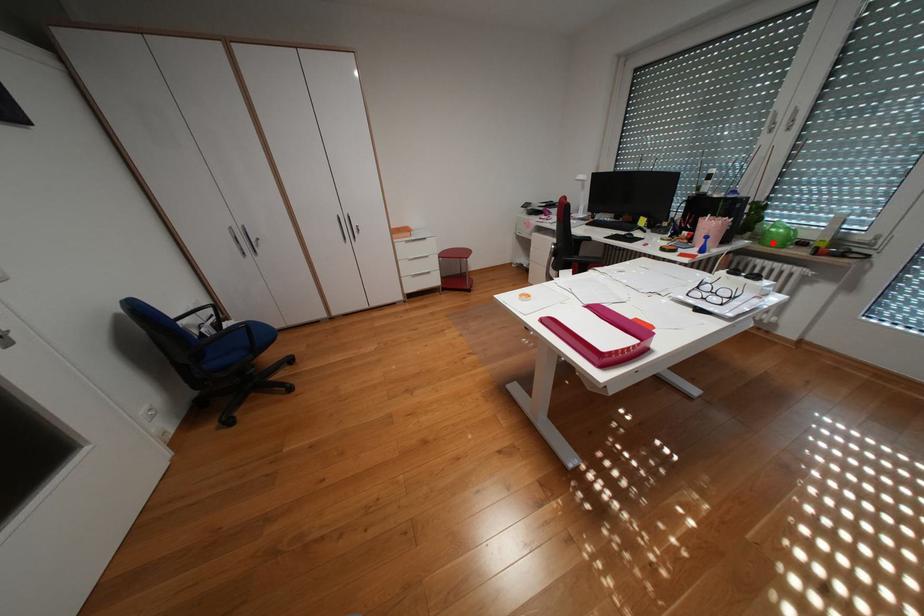
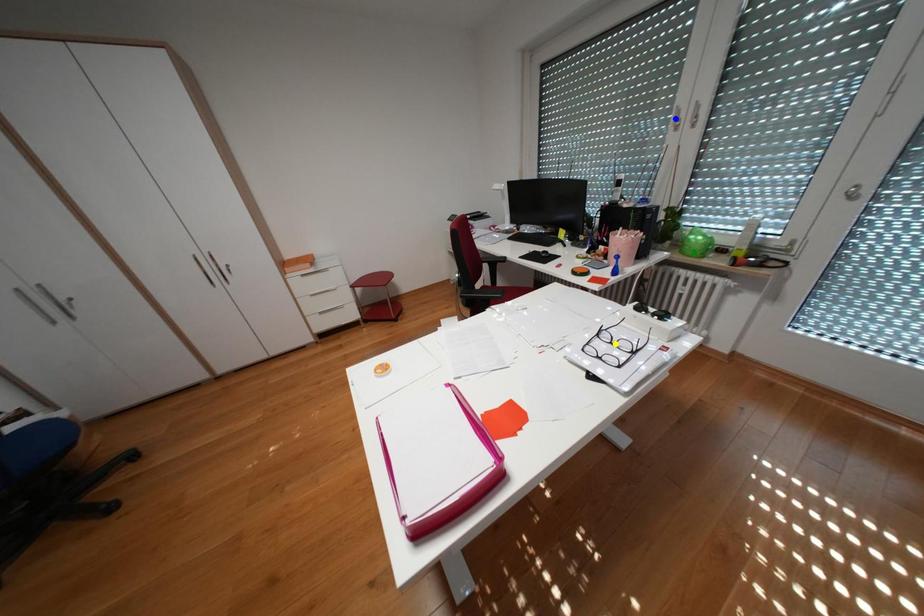
Question: I am providing you with two images of the same scene from different viewpoints. A red point is marked on the first image. You are given multiple points on the second image. Which point in image 2 represents the same 3d spot as the red point in image 1?

Choices:
 (A) blue point
 (B) green point
 (C) yellow point

Answer: (B)